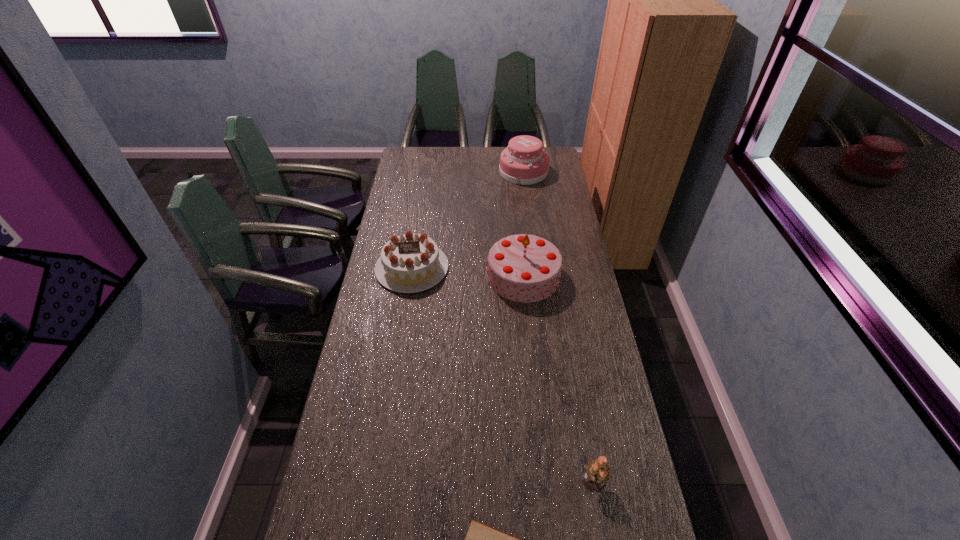
What are the coordinates of `the tallest birthday cake` in the screenshot? It's located at (524, 268).

Find the location of a particular element. the second tallest birthday cake is located at coordinates (524, 162).

You are a GUI agent. You are given a task and a screenshot of the screen. Output one action in this format:
    pyautogui.click(x=<x>, y=<y>)
    Task: Click on the fourth shortest object
    Image resolution: width=960 pixels, height=540 pixels.
    Given the screenshot: What is the action you would take?
    pyautogui.click(x=524, y=162)

This screenshot has width=960, height=540. I want to click on the shortest birthday cake, so click(x=409, y=263).

You are a GUI agent. You are given a task and a screenshot of the screen. Output one action in this format:
    pyautogui.click(x=<x>, y=<y>)
    Task: Click on the leftmost birthday cake
    
    Given the screenshot: What is the action you would take?
    pyautogui.click(x=409, y=263)

This screenshot has width=960, height=540. I want to click on candle holder, so click(597, 473).

Image resolution: width=960 pixels, height=540 pixels. I want to click on vacant space located on the left of the tallest object, so click(388, 276).

Image resolution: width=960 pixels, height=540 pixels. In order to click on free space located on the left of the second shortest birthday cake in this screenshot , I will do `click(452, 172)`.

Identify the location of free spot located 0.370m on the right of the shortest birthday cake. The image size is (960, 540). (538, 268).

Where is `vacant space located on the left of the fourth farthest object`? The height and width of the screenshot is (540, 960). vacant space located on the left of the fourth farthest object is located at coordinates (467, 480).